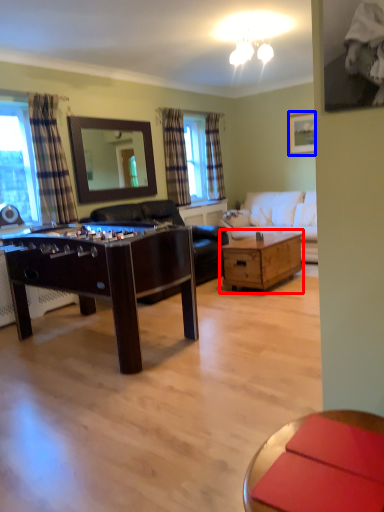
Question: Among these objects, which one is farthest to the camera, table (highlighted by a red box) or picture frame (highlighted by a blue box)?

Choices:
 (A) table
 (B) picture frame

Answer: (B)